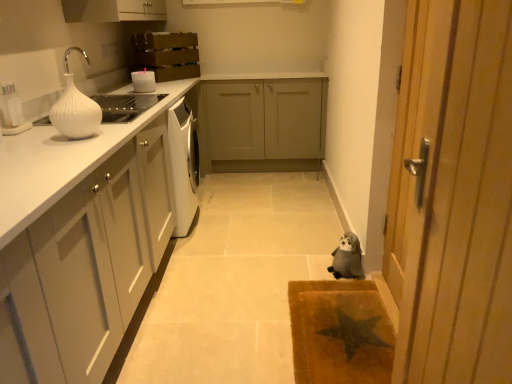
Where is `free point in front of white glossy knife block at upper left, which ranks as the 1th appliance in front-to-back order`? free point in front of white glossy knife block at upper left, which ranks as the 1th appliance in front-to-back order is located at coordinates (16, 139).